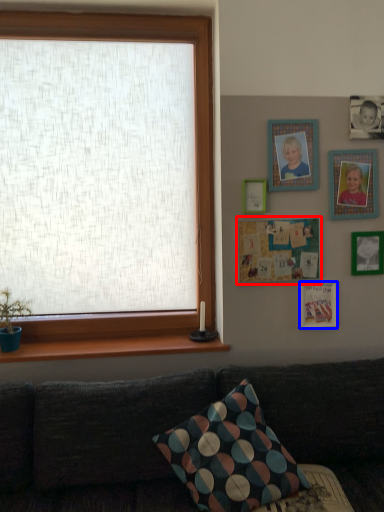
Question: Which of the following is the closest to the observer, picture frame (highlighted by a red box) or picture frame (highlighted by a blue box)?

Choices:
 (A) picture frame
 (B) picture frame

Answer: (A)